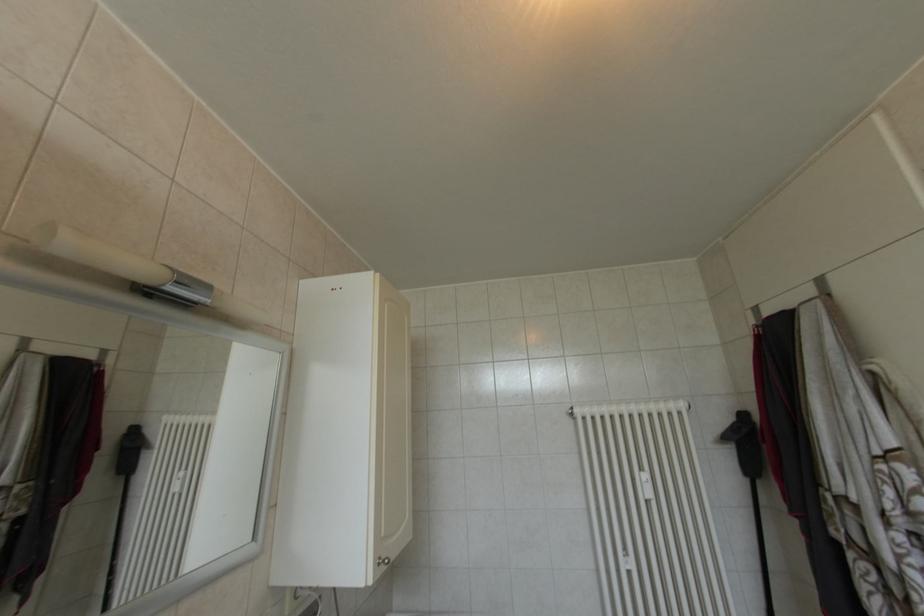
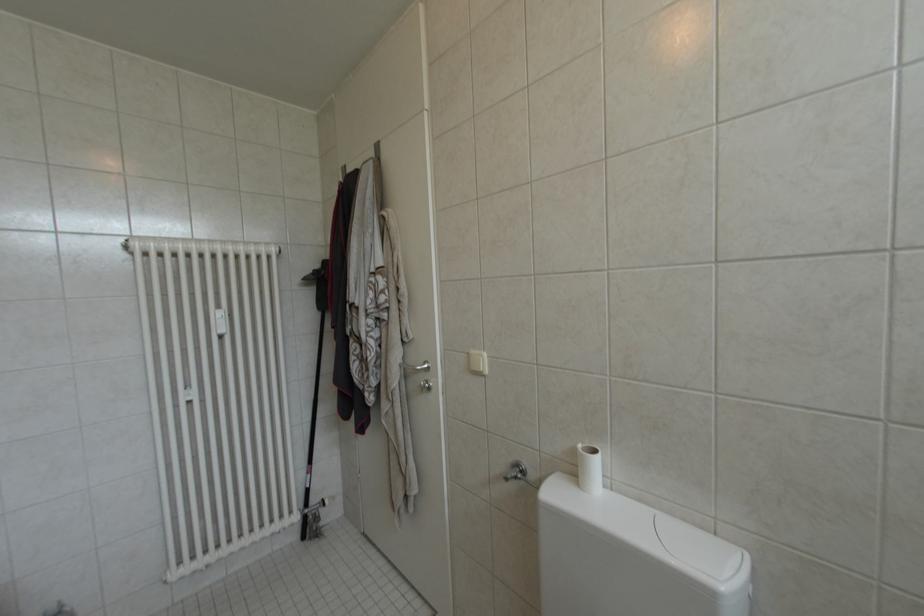
Question: The camera is either moving clockwise (left) or counter-clockwise (right) around the object. The first image is from the beginning of the video and the second image is from the end. Is the camera moving left or right when shooting the video?

Choices:
 (A) Left
 (B) Right

Answer: (A)